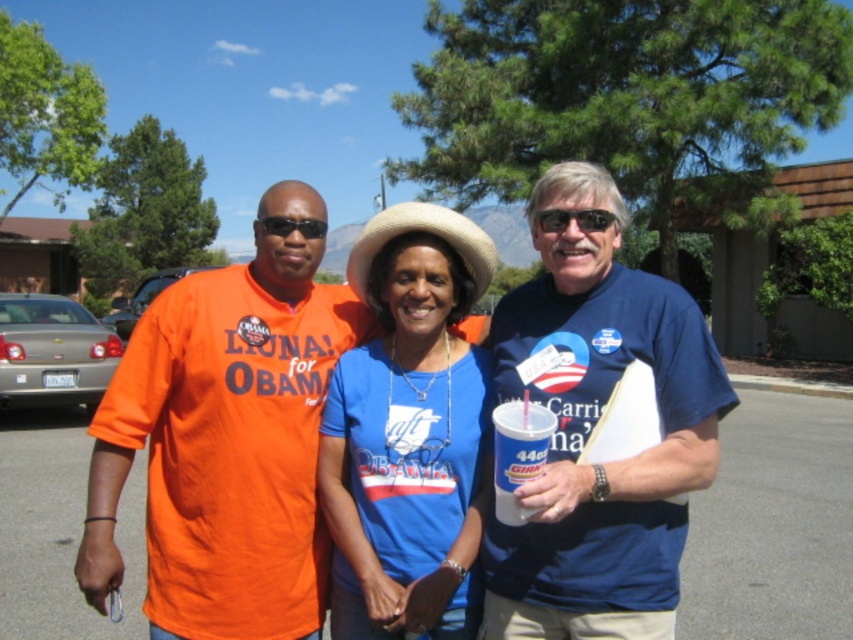
Question: Which of the following is the closest to the observer?

Choices:
 (A) blue fabric shirt at center
 (B) gray asphalt parking lot at center
 (C) matte orange t-shirt at center
 (D) orange cotton shirt at left

Answer: (D)

Question: Considering the relative positions of blue fabric shirt at center and natural straw cowboy hat at center in the image provided, where is blue fabric shirt at center located with respect to natural straw cowboy hat at center?

Choices:
 (A) above
 (B) below

Answer: (B)

Question: Estimate the real-world distances between objects in this image. Which object is farther from the blue cotton shirt at center?

Choices:
 (A) natural straw cowboy hat at center
 (B) blue fabric shirt at center
 (C) orange cotton shirt at left

Answer: (A)

Question: Does blue cotton shirt at center have a lesser width compared to gray asphalt parking lot at center?

Choices:
 (A) yes
 (B) no

Answer: (A)

Question: Is the position of orange cotton shirt at left less distant than that of natural straw cowboy hat at center?

Choices:
 (A) no
 (B) yes

Answer: (B)

Question: Which object is farther from the camera taking this photo?

Choices:
 (A) gray asphalt parking lot at center
 (B) blue cotton shirt at center

Answer: (A)